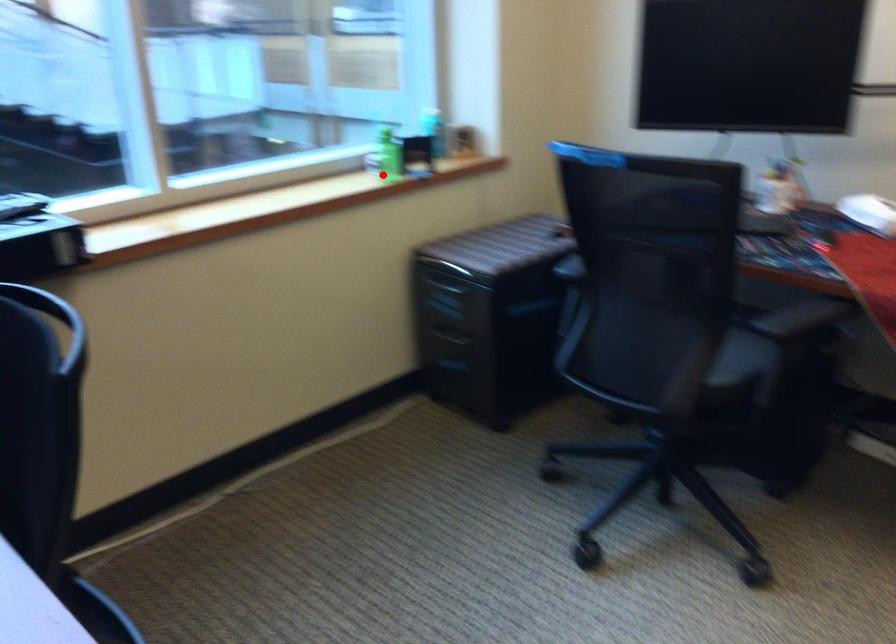
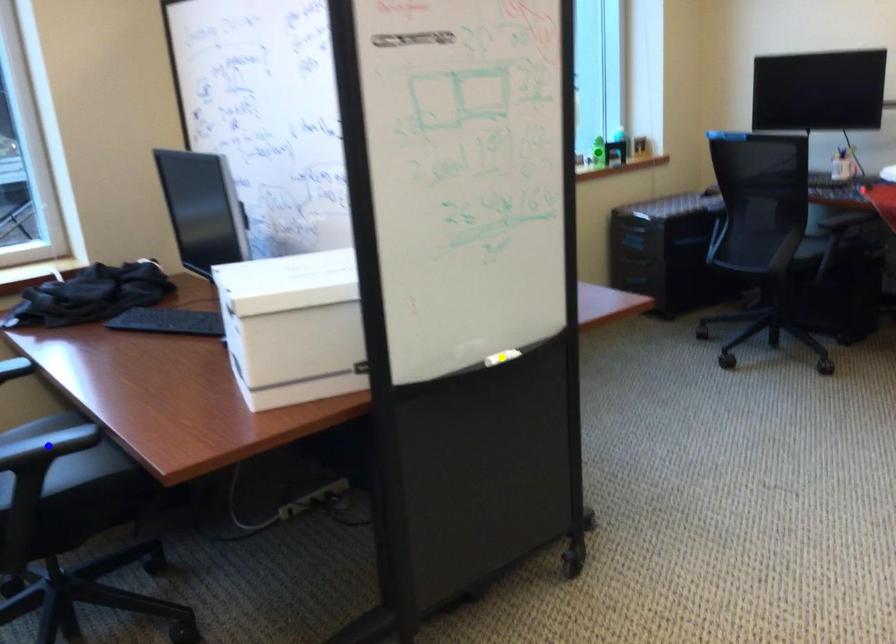
Question: I am providing you with two images of the same scene from different viewpoints. A red point is marked on the first image. You are given multiple points on the second image. In image 2, which mark is for the same physical point as the one in image 1?

Choices:
 (A) yellow point
 (B) green point
 (C) blue point

Answer: (B)